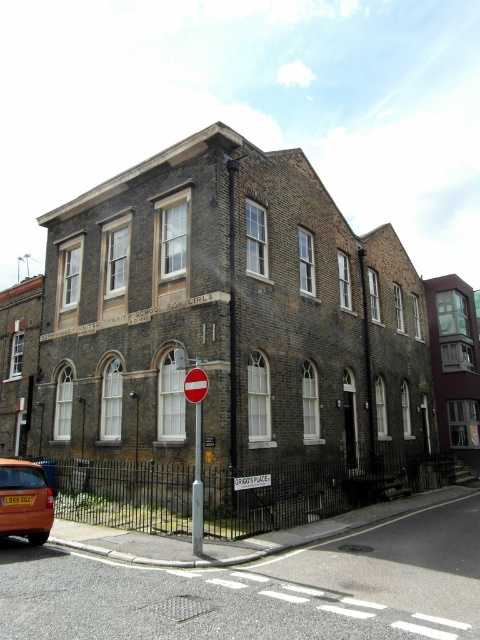
Does orange matte car at lower left appear on the right side of red plastic stop sign at center?

In fact, orange matte car at lower left is to the left of red plastic stop sign at center.

Can you confirm if orange matte car at lower left is shorter than red plastic stop sign at center?

No, orange matte car at lower left is not shorter than red plastic stop sign at center.

Is point (0, 488) positioned after point (200, 394)?

No, (0, 488) is in front of (200, 394).

Where is `orange matte car at lower left`? The width and height of the screenshot is (480, 640). orange matte car at lower left is located at coordinates (24, 500).

Is point (199, 376) positioned before point (245, 476)?

Yes.

The image size is (480, 640). I want to click on red plastic stop sign at center, so click(195, 385).

You are a GUI agent. You are given a task and a screenshot of the screen. Output one action in this format:
    pyautogui.click(x=<x>, y=<y>)
    Task: Click on the red plastic stop sign at center
    Image resolution: width=480 pixels, height=640 pixels.
    Given the screenshot: What is the action you would take?
    pyautogui.click(x=195, y=385)

Can you confirm if metallic pole at center is thinner than white plastic sign at center?

Correct, metallic pole at center's width is less than white plastic sign at center's.

Describe the element at coordinates (196, 488) in the screenshot. I see `metallic pole at center` at that location.

Is point (192, 516) farther from camera compared to point (245, 481)?

Yes, point (192, 516) is farther from viewer.

Where is `metallic pole at center`? This screenshot has width=480, height=640. metallic pole at center is located at coordinates (196, 488).